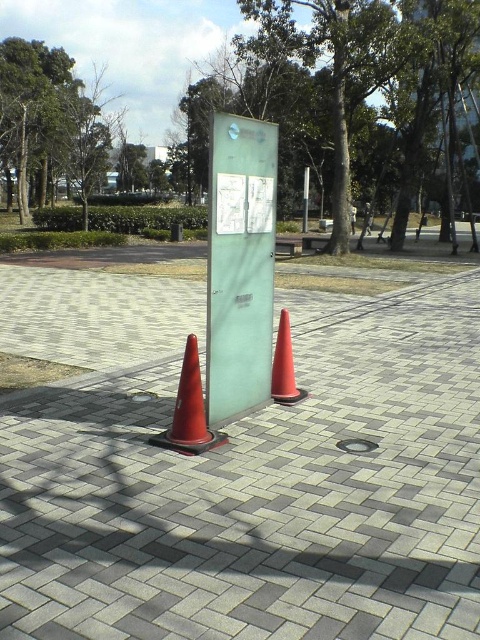
Question: Which of the following is the farthest from the observer?

Choices:
 (A) 287,353
 (B) 172,492
 (C) 240,179
 (D) 307,189

Answer: (D)

Question: Is green glass sign at center thinner than rubberized red traffic cone at lower left?

Choices:
 (A) no
 (B) yes

Answer: (B)

Question: Which object is closer to the camera taking this photo?

Choices:
 (A) gray brick pavement at center
 (B) rubberized red traffic cone at lower left
 (C) green glass sign at center
 (D) silver metallic pole at center

Answer: (A)

Question: Which point is farther from the camera taking this photo?

Choices:
 (A) (12, 496)
 (B) (215, 390)
 (C) (290, 358)

Answer: (C)

Question: Can you confirm if rubberized red traffic cone at lower left is positioned to the left of silver metallic pole at center?

Choices:
 (A) yes
 (B) no

Answer: (A)

Question: Does rubberized red traffic cone at lower left appear over silver metallic pole at center?

Choices:
 (A) yes
 (B) no

Answer: (B)